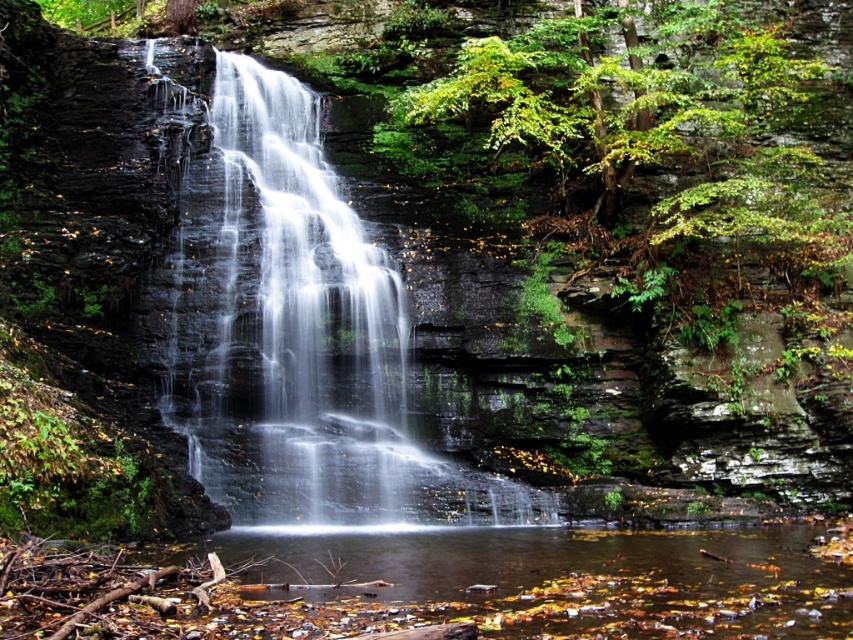
Which is behind, point (231, 412) or point (402, 532)?

Point (231, 412)

Which is more to the right, translucent white water at center or clear water at center?

clear water at center is more to the right.

Is point (344, 380) positioned behind point (532, 563)?

Yes.

The image size is (853, 640). Identify the location of translucent white water at center. (299, 333).